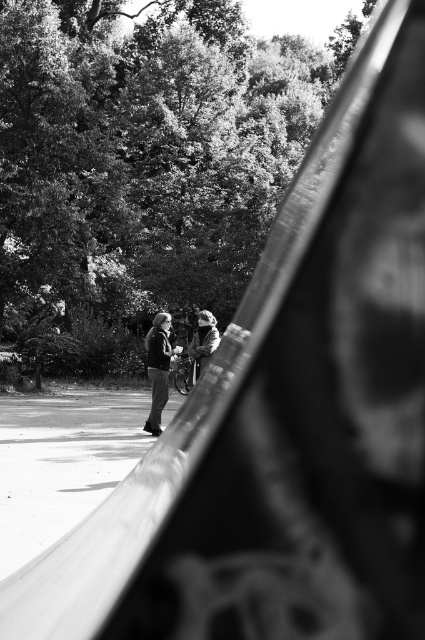
Question: Does dark gray jacket at center appear under light brown leather jacket at center?

Choices:
 (A) yes
 (B) no

Answer: (A)

Question: Which point is farther to the camera?

Choices:
 (A) (195, 337)
 (B) (156, 355)

Answer: (A)

Question: Does dark gray jacket at center appear over light brown leather jacket at center?

Choices:
 (A) yes
 (B) no

Answer: (B)

Question: Which of the following is the closest to the observer?

Choices:
 (A) (163, 385)
 (B) (192, 371)

Answer: (A)

Question: Considering the relative positions of dark gray jacket at center and light brown leather jacket at center in the image provided, where is dark gray jacket at center located with respect to light brown leather jacket at center?

Choices:
 (A) above
 (B) below

Answer: (B)